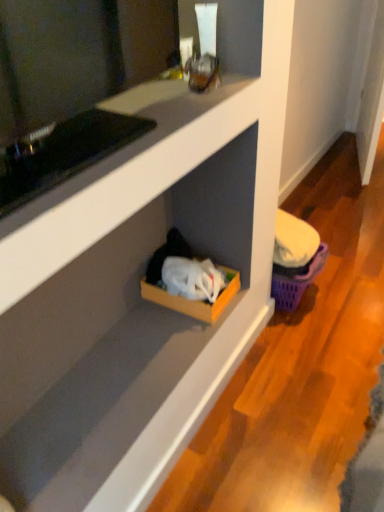
Image resolution: width=384 pixels, height=512 pixels. In order to click on free space in front of purple plastic basket at lower right in this screenshot , I will do `click(310, 339)`.